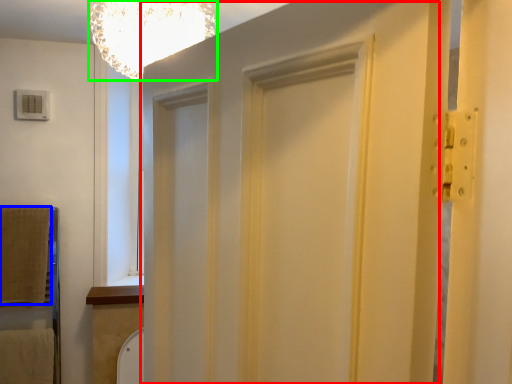
Question: Based on their relative distances, which object is nearer to barn door (highlighted by a red box)? Choose from blanket (highlighted by a blue box) and light fixture (highlighted by a green box).

Choices:
 (A) blanket
 (B) light fixture

Answer: (B)